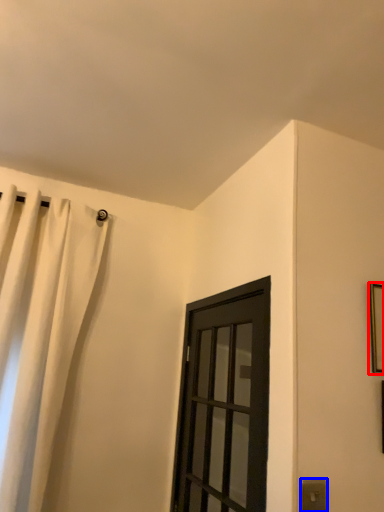
Question: Which object appears closest to the camera in this image, picture frame (highlighted by a red box) or electric outlet (highlighted by a blue box)?

Choices:
 (A) picture frame
 (B) electric outlet

Answer: (B)